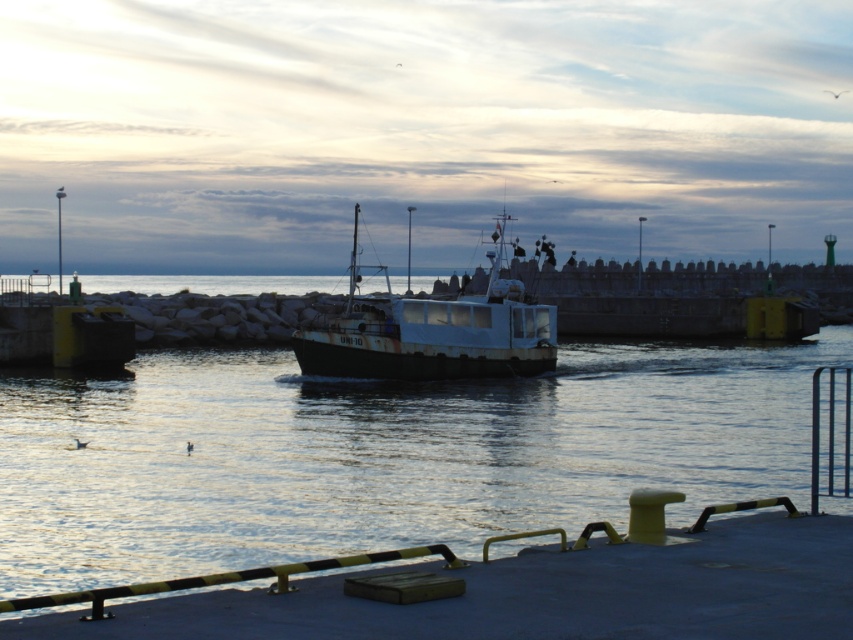
You are a photographer planning to capture the entire scene of the shiny metallic water at center and the rusty metal boat at center in one shot. Given that your camera has a fixed focal length, which object should you position closer to ensure both fit in the frame?

Since the shiny metallic water at center is wider than the rusty metal boat at center, you should position yourself closer to the rusty metal boat at center to ensure both fit in the frame.

You are standing on the smooth rubber dock at lower center and want to reach the boat named UM 170. The boat is 8.85 meters away from the dock. If your boat has a 10 meter rope, will it be enough to reach the boat from the dock?

The distance between the smooth rubber dock at lower center and the boat is 8.85 meters. Since the rope is 10 meters long, it is sufficient to reach the boat from the dock.